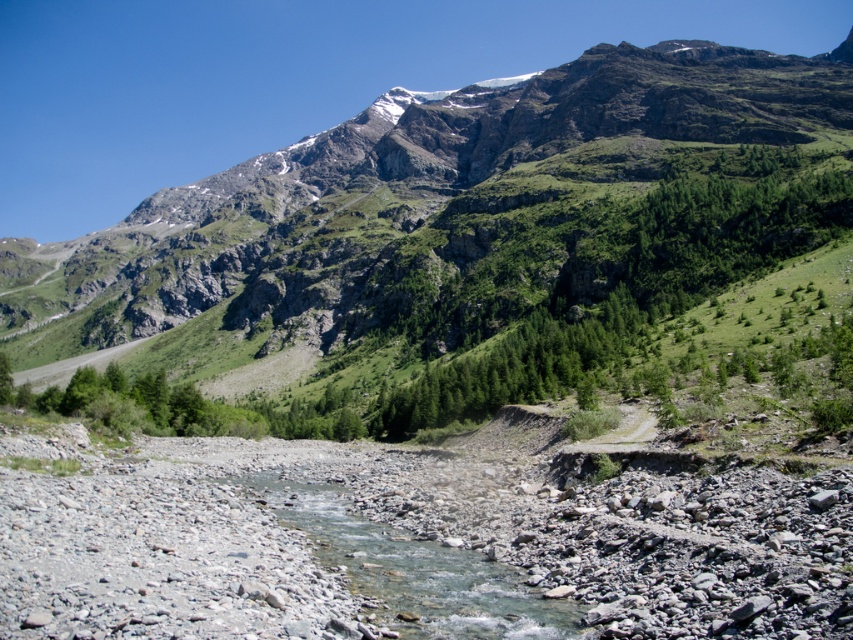
Question: Is green rocky mountain at upper center bigger than clear water at center?

Choices:
 (A) yes
 (B) no

Answer: (A)

Question: Where is green rocky mountain at upper center located in relation to clear water at center in the image?

Choices:
 (A) above
 (B) below

Answer: (A)

Question: Which object appears farthest from the camera in this image?

Choices:
 (A) clear water at center
 (B) green rocky mountain at upper center

Answer: (B)

Question: Does green rocky mountain at upper center appear on the left side of clear water at center?

Choices:
 (A) no
 (B) yes

Answer: (B)

Question: Which object is closer to the camera taking this photo?

Choices:
 (A) clear water at center
 (B) green rocky mountain at upper center

Answer: (A)